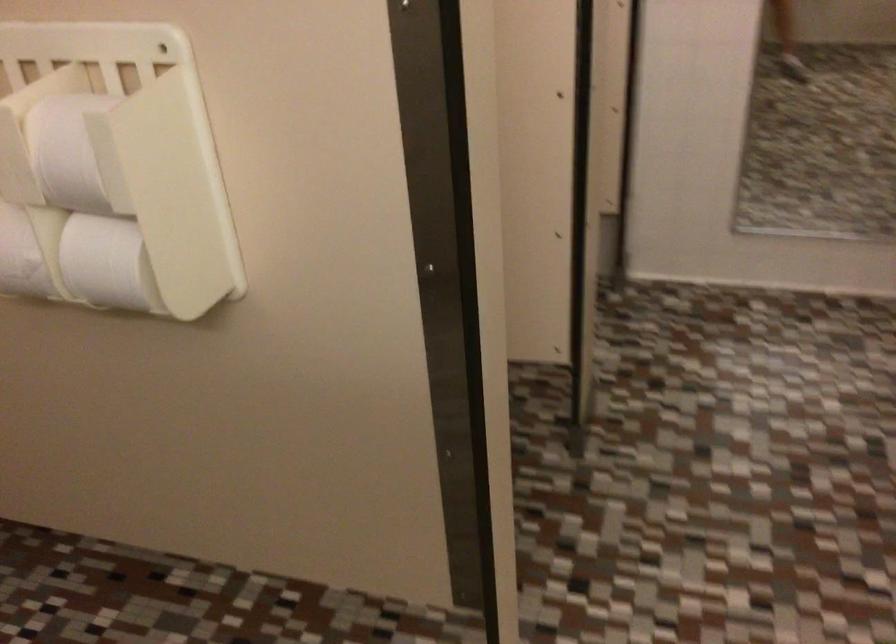
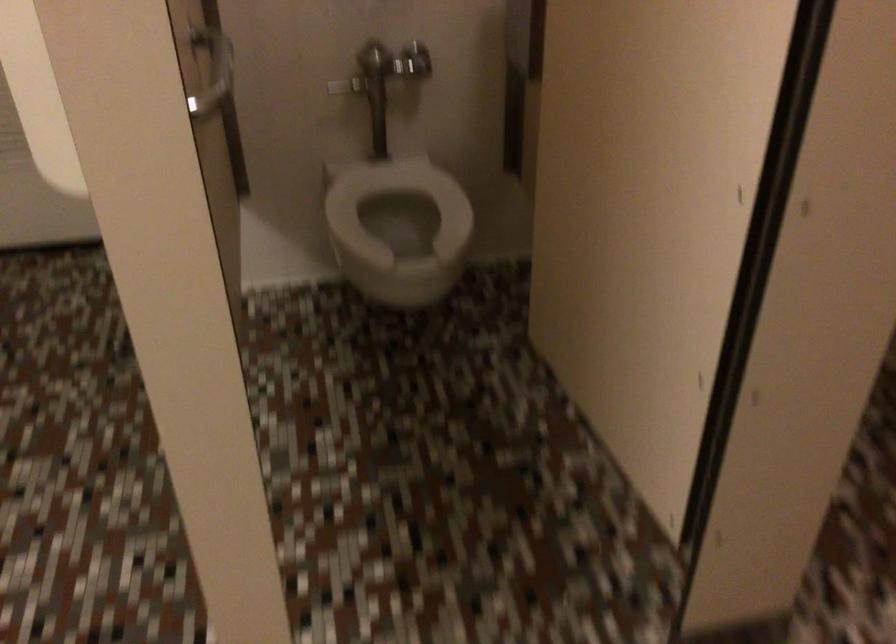
Based on the continuous images, in which direction is the camera rotating?

The camera rotated toward left-down.